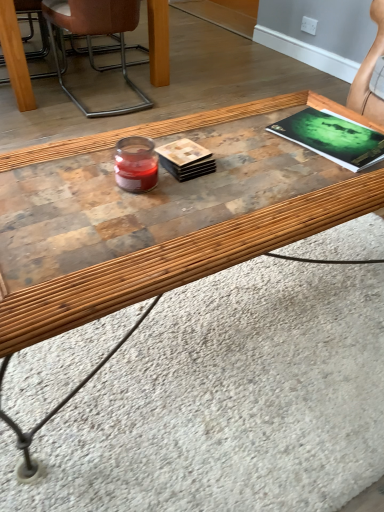
Locate an element on the screen. green matte magazine at upper right is located at coordinates (332, 138).

What do you see at coordinates (332, 138) in the screenshot? I see `green matte magazine at upper right` at bounding box center [332, 138].

At what (x,y) coordinates should I click in order to perform the action: click on brown leather chair at upper left. Please return your answer as a coordinate pair (x, y). This screenshot has width=384, height=512. Looking at the image, I should click on (96, 34).

This screenshot has width=384, height=512. What do you see at coordinates (96, 34) in the screenshot?
I see `brown leather chair at upper left` at bounding box center [96, 34].

I want to click on green matte magazine at upper right, so click(332, 138).

Based on their positions, is green matte magazine at upper right located to the left or right of brown leather chair at upper left?

green matte magazine at upper right is positioned on brown leather chair at upper left's right side.

Which object is further away from the camera taking this photo, green matte magazine at upper right or brown leather chair at upper left?

brown leather chair at upper left.

Considering the positions of point (313, 140) and point (70, 94), is point (313, 140) closer or farther from the camera than point (70, 94)?

Point (313, 140).

From the image's perspective, does green matte magazine at upper right appear lower than brown leather chair at upper left?

Yes, from the image's perspective, green matte magazine at upper right is below brown leather chair at upper left.

From a real-world perspective, relative to brown leather chair at upper left, is green matte magazine at upper right vertically above or below?

From a real-world perspective, green matte magazine at upper right is physically above brown leather chair at upper left.

Can you confirm if green matte magazine at upper right is wider than brown leather chair at upper left?

In fact, green matte magazine at upper right might be narrower than brown leather chair at upper left.

Considering the sizes of objects green matte magazine at upper right and brown leather chair at upper left in the image provided, who is shorter, green matte magazine at upper right or brown leather chair at upper left?

With less height is green matte magazine at upper right.

Considering the relative sizes of green matte magazine at upper right and brown leather chair at upper left in the image provided, is green matte magazine at upper right smaller than brown leather chair at upper left?

Yes, green matte magazine at upper right is smaller than brown leather chair at upper left.

Is brown leather chair at upper left surrounded by green matte magazine at upper right?

That's incorrect, brown leather chair at upper left is not inside green matte magazine at upper right.

Is green matte magazine at upper right far from brown leather chair at upper left?

Indeed, green matte magazine at upper right is not near brown leather chair at upper left.

Is green matte magazine at upper right facing away from brown leather chair at upper left?

No, brown leather chair at upper left is not at the back of green matte magazine at upper right.

Can you tell me how much green matte magazine at upper right and brown leather chair at upper left differ in facing direction?

The facing directions of green matte magazine at upper right and brown leather chair at upper left are 16.4 degrees apart.

How much distance is there between green matte magazine at upper right and brown leather chair at upper left?

1.54 meters.

The image size is (384, 512). What are the coordinates of `magazine above the brown leather chair at upper left (from a real-world perspective)` in the screenshot? It's located at (332, 138).

Considering the relative positions of brown leather chair at upper left and green matte magazine at upper right in the image provided, is brown leather chair at upper left to the left of green matte magazine at upper right from the viewer's perspective?

Indeed, brown leather chair at upper left is positioned on the left side of green matte magazine at upper right.

Is the depth of brown leather chair at upper left less than that of green matte magazine at upper right?

No, brown leather chair at upper left is further to the viewer.

Which is closer to the camera, (127, 1) or (362, 143)?

Clearly, point (127, 1) is more distant from the camera than point (362, 143).

From the image's perspective, is brown leather chair at upper left positioned above or below green matte magazine at upper right?

brown leather chair at upper left is situated higher than green matte magazine at upper right in the image.

From a real-world perspective, is brown leather chair at upper left positioned over green matte magazine at upper right based on gravity?

Incorrect, from a real-world perspective, brown leather chair at upper left is lower than green matte magazine at upper right.

Does brown leather chair at upper left have a greater width compared to green matte magazine at upper right?

Yes.

Considering the sizes of objects brown leather chair at upper left and green matte magazine at upper right in the image provided, who is taller, brown leather chair at upper left or green matte magazine at upper right?

Standing taller between the two is brown leather chair at upper left.

Can you confirm if brown leather chair at upper left is bigger than green matte magazine at upper right?

Correct, brown leather chair at upper left is larger in size than green matte magazine at upper right.

Would you say brown leather chair at upper left contains green matte magazine at upper right?

No, brown leather chair at upper left does not contain green matte magazine at upper right.

Is brown leather chair at upper left directly adjacent to green matte magazine at upper right?

brown leather chair at upper left and green matte magazine at upper right are not in contact.

Is brown leather chair at upper left aimed at green matte magazine at upper right?

Answer: No.

Measure the distance from brown leather chair at upper left to green matte magazine at upper right.

The distance of brown leather chair at upper left from green matte magazine at upper right is 1.54 meters.

You are a GUI agent. You are given a task and a screenshot of the screen. Output one action in this format:
    pyautogui.click(x=<x>, y=<y>)
    Task: Click on the magazine located below the brown leather chair at upper left (from the image's perspective)
    The height and width of the screenshot is (512, 384).
    Given the screenshot: What is the action you would take?
    pos(332,138)

You are a GUI agent. You are given a task and a screenshot of the screen. Output one action in this format:
    pyautogui.click(x=<x>, y=<y>)
    Task: Click on the chair behind the green matte magazine at upper right
    
    Given the screenshot: What is the action you would take?
    pyautogui.click(x=96, y=34)

At what (x,y) coordinates should I click in order to perform the action: click on magazine to the right of brown leather chair at upper left. Please return your answer as a coordinate pair (x, y). Looking at the image, I should click on (332, 138).